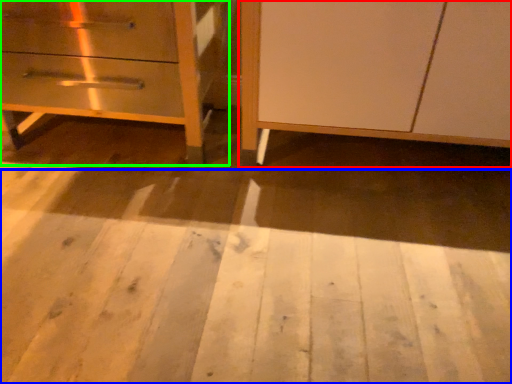
Question: Which is nearer to the furniture (highlighted by a red box)? plywood (highlighted by a blue box) or chest of drawers (highlighted by a green box).

Choices:
 (A) plywood
 (B) chest of drawers

Answer: (A)